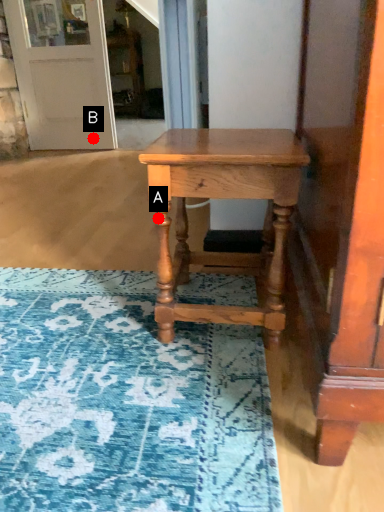
Question: Two points are circled on the image, labeled by A and B beside each circle. Which point appears closest to the camera in this image?

Choices:
 (A) A is closer
 (B) B is closer

Answer: (A)